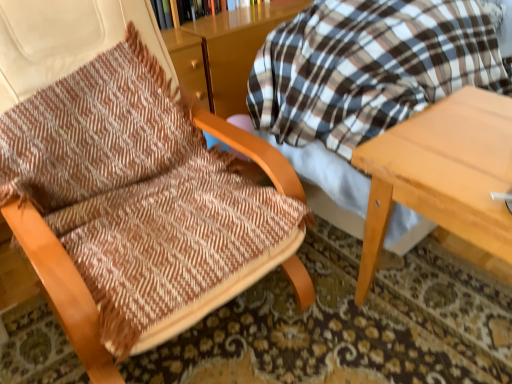
Question: Is point [74, 102] positioned closer to the camera than point [156, 1]?

Choices:
 (A) closer
 (B) farther

Answer: (A)

Question: Considering their positions, is brown woven fabric chair at left located in front of or behind wooden bookcase at upper center?

Choices:
 (A) behind
 (B) front

Answer: (B)

Question: Which object is the farthest from the wooden bookcase at upper center?

Choices:
 (A) light wood table at right
 (B) brown woven fabric chair at left

Answer: (A)

Question: Which is nearer to the wooden bookcase at upper center?

Choices:
 (A) brown woven fabric chair at left
 (B) light wood table at right

Answer: (A)